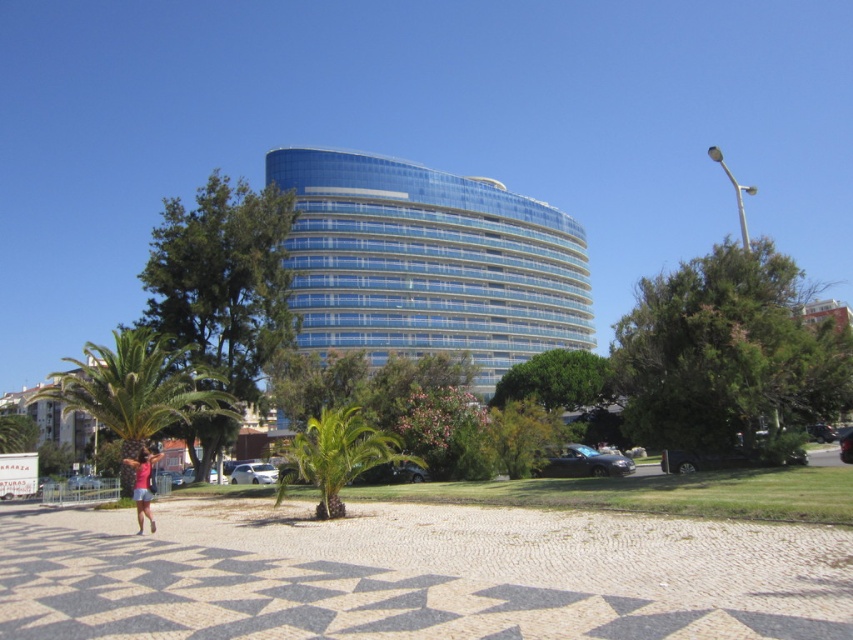
Which is in front, point (587, 275) or point (154, 531)?

Point (154, 531) is in front.

Based on the photo, who is more distant from viewer, (x=323, y=225) or (x=143, y=509)?

Point (x=323, y=225)

Locate an element on the screen. blue glass building at center is located at coordinates (428, 262).

Does green leafy palm tree at lower left appear over pink fabric at lower left?

Indeed, green leafy palm tree at lower left is positioned over pink fabric at lower left.

Can you confirm if green leafy palm tree at lower left is shorter than pink fabric at lower left?

In fact, green leafy palm tree at lower left may be taller than pink fabric at lower left.

Describe the element at coordinates (138, 387) in the screenshot. I see `green leafy palm tree at lower left` at that location.

Locate an element on the screen. Image resolution: width=853 pixels, height=640 pixels. green leafy palm tree at lower left is located at coordinates (138, 387).

Can you confirm if blue glass building at center is wider than green leafy palm tree at lower left?

Correct, the width of blue glass building at center exceeds that of green leafy palm tree at lower left.

Is blue glass building at center further to camera compared to green leafy palm tree at lower left?

That is True.

Who is more distant from viewer, (338,269) or (154,358)?

The point (338,269) is behind.

Image resolution: width=853 pixels, height=640 pixels. What are the coordinates of `blue glass building at center` in the screenshot? It's located at (428, 262).